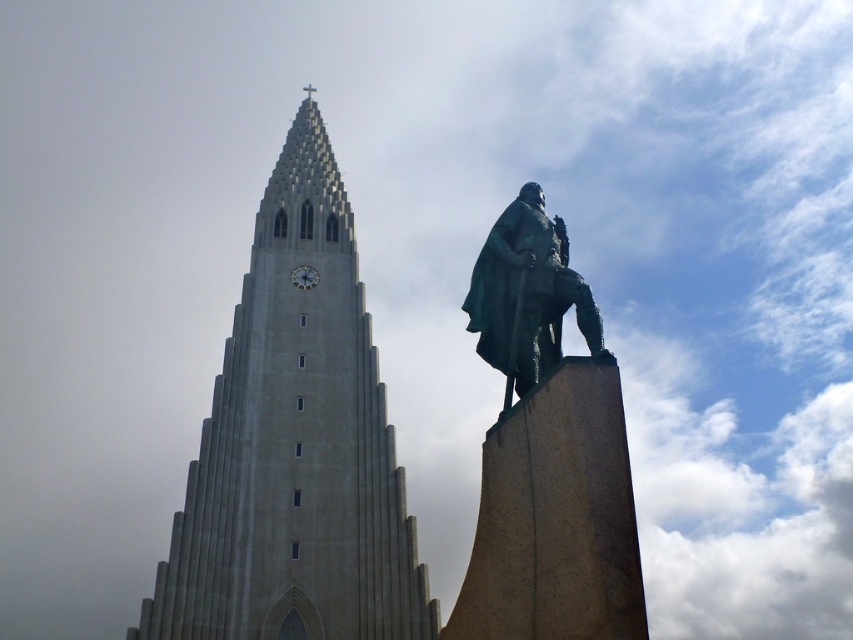
You are standing at the center of the image and want to locate the gray stone tower at center. In which direction should you look to find it?

The gray stone tower at center is located at the center of the image, so you should look straight ahead to find it.

You are standing in front of the gray stone tower at center and the bronze statue at right. Which object is closer to you?

The bronze statue at right is closer to you because the gray stone tower at center is positioned over it, meaning the tower is behind the statue.

You are standing in front of the gray stone tower at center and the bronze statue at right. Which object is closer to you?

The gray stone tower at center is closer to you since it is positioned further to the viewer than the bronze statue at right.